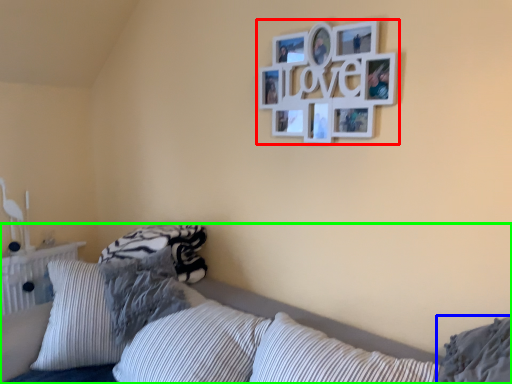
Question: Based on their relative distances, which object is nearer to picture frame (highlighted by a red box)? Choose from pillow (highlighted by a blue box) and bed (highlighted by a green box).

Choices:
 (A) pillow
 (B) bed

Answer: (B)